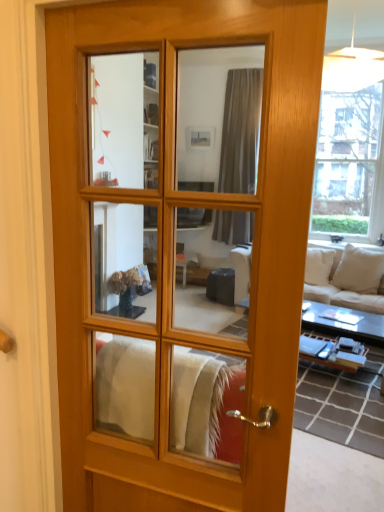
Question: Is white fabric couch at right to the left of matte wood door at center from the viewer's perspective?

Choices:
 (A) no
 (B) yes

Answer: (A)

Question: Is white fabric couch at right facing towards matte wood door at center?

Choices:
 (A) yes
 (B) no

Answer: (A)

Question: From the image's perspective, does white fabric couch at right appear lower than matte wood door at center?

Choices:
 (A) no
 (B) yes

Answer: (B)

Question: Are white fabric couch at right and matte wood door at center making contact?

Choices:
 (A) yes
 (B) no

Answer: (B)

Question: Is white fabric couch at right turned away from matte wood door at center?

Choices:
 (A) no
 (B) yes

Answer: (A)

Question: From a real-world perspective, is white fabric couch at right positioned over matte wood door at center based on gravity?

Choices:
 (A) yes
 (B) no

Answer: (B)

Question: Can you see matte wood door at center touching white fabric couch at right?

Choices:
 (A) no
 (B) yes

Answer: (A)

Question: Is matte wood door at center closer to the viewer compared to white fabric couch at right?

Choices:
 (A) yes
 (B) no

Answer: (A)

Question: Considering the relative sizes of matte wood door at center and white fabric couch at right in the image provided, is matte wood door at center wider than white fabric couch at right?

Choices:
 (A) no
 (B) yes

Answer: (A)

Question: Considering the relative sizes of matte wood door at center and white fabric couch at right in the image provided, is matte wood door at center bigger than white fabric couch at right?

Choices:
 (A) yes
 (B) no

Answer: (B)

Question: Considering the relative sizes of matte wood door at center and white fabric couch at right in the image provided, is matte wood door at center shorter than white fabric couch at right?

Choices:
 (A) no
 (B) yes

Answer: (A)

Question: From a real-world perspective, is matte wood door at center below white fabric couch at right?

Choices:
 (A) yes
 (B) no

Answer: (B)

Question: Based on their positions, is white fabric couch at right located to the left or right of matte wood door at center?

Choices:
 (A) right
 (B) left

Answer: (A)